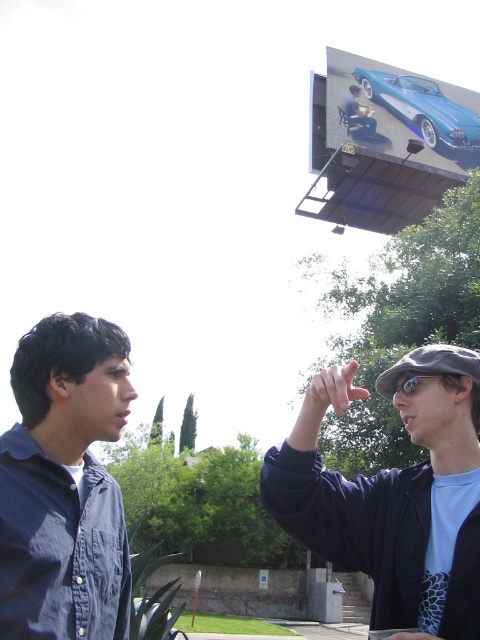
You are a photographer standing at the denim shirt at left and want to take a photo of the matte black car at upper center. Given that your camera has a maximum focus range of 30 meters, will you be able to capture the car clearly?

The denim shirt at left and matte black car at upper center are 34.26 meters apart. Since the distance exceeds the camera maximum focus range of 30 meters, you won not be able to capture the matte black car at upper center clearly.